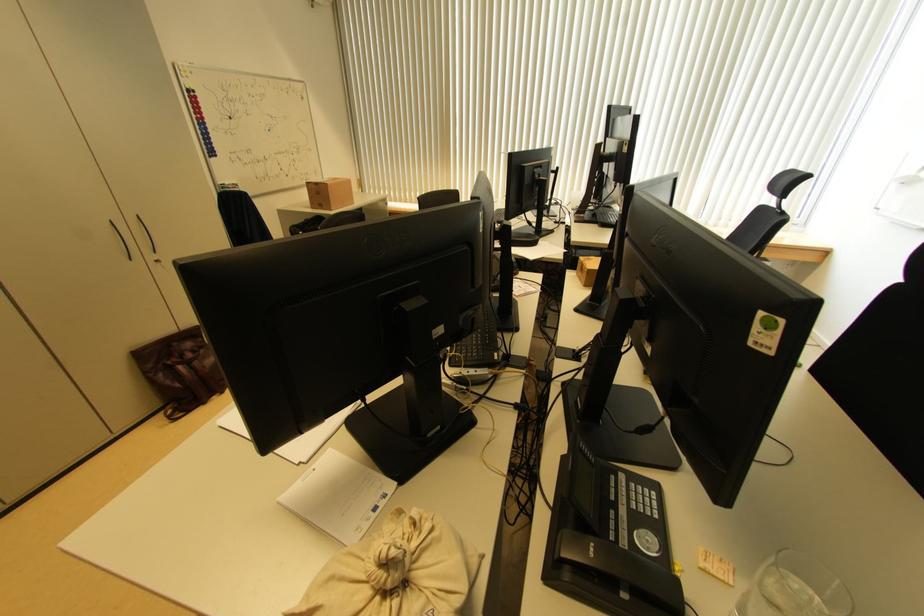
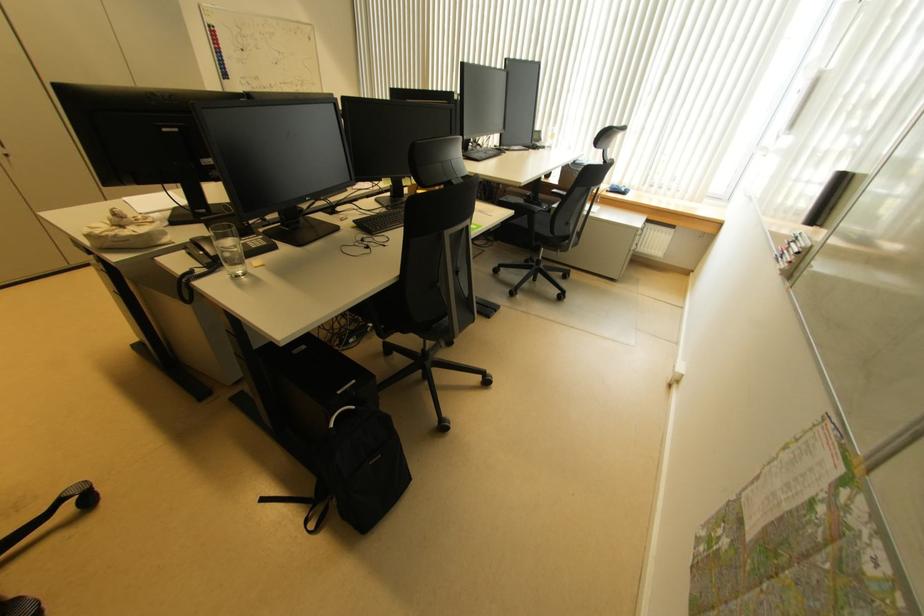
The images are taken continuously from a first-person perspective. In which direction are you moving?

The cameraman moved toward right, backward.